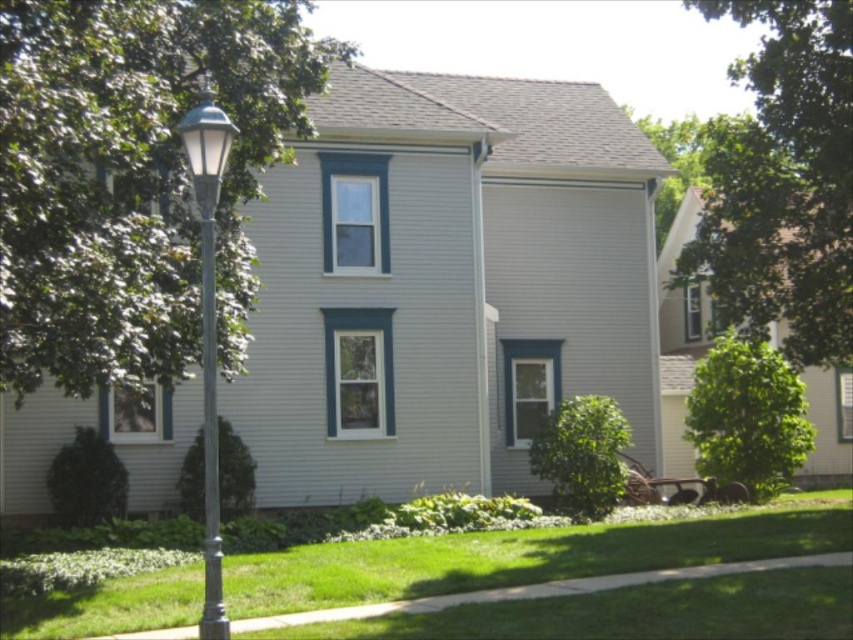
Question: Is the position of green leafy tree at upper right more distant than that of green grass at lower center?

Choices:
 (A) yes
 (B) no

Answer: (A)

Question: Does green leafy tree at left have a lesser width compared to green grass at lower center?

Choices:
 (A) no
 (B) yes

Answer: (B)

Question: Which of the following is the closest to the observer?

Choices:
 (A) green leafy tree at right
 (B) green leafy tree at lower left

Answer: (B)

Question: Which object is the farthest from the metallic gray pole at left?

Choices:
 (A) green leafy bush at lower center
 (B) green leafy tree at right
 (C) green leafy tree at upper right

Answer: (C)

Question: Is metallic gray pole at left closer to camera compared to green leafy bush at lower left?

Choices:
 (A) yes
 (B) no

Answer: (A)

Question: Which of the following is the closest to the observer?

Choices:
 (A) (216, 488)
 (B) (173, 193)
 (C) (776, 355)

Answer: (A)